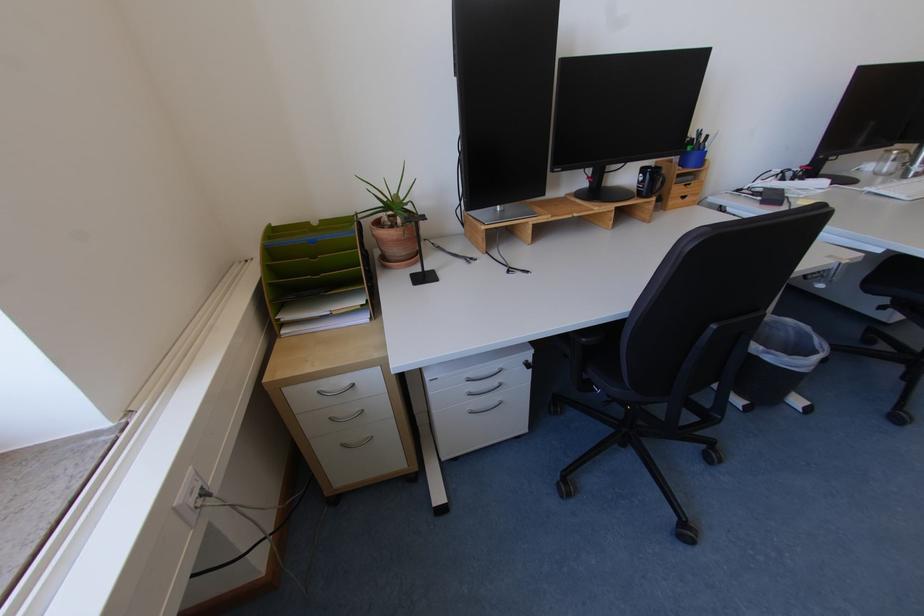
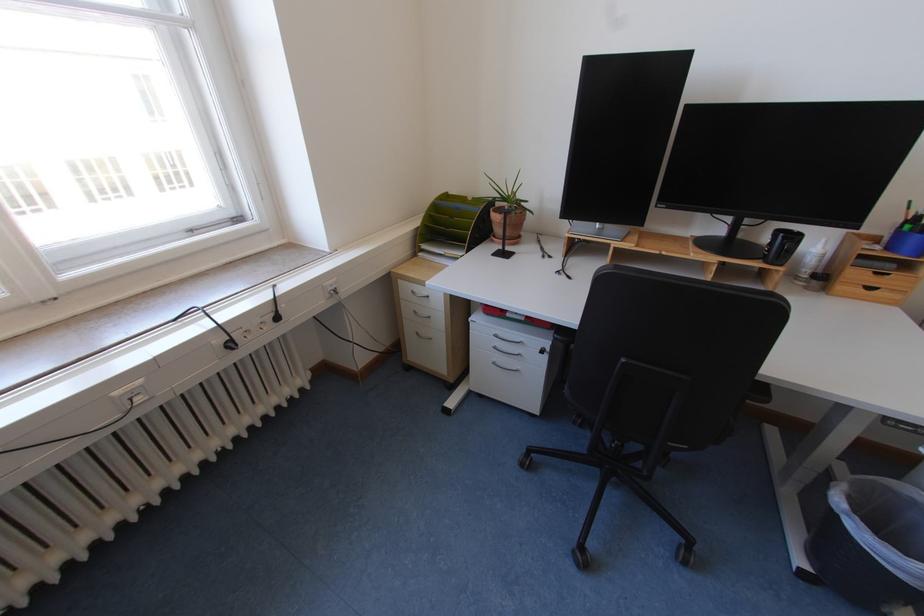
Locate, in the second image, the point that corresponds to (755,403) in the first image.

(819, 572)